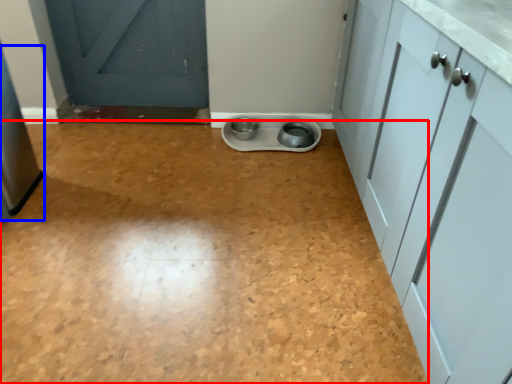
Question: Among these objects, which one is farthest to the camera, plain (highlighted by a red box) or appliance (highlighted by a blue box)?

Choices:
 (A) plain
 (B) appliance

Answer: (B)